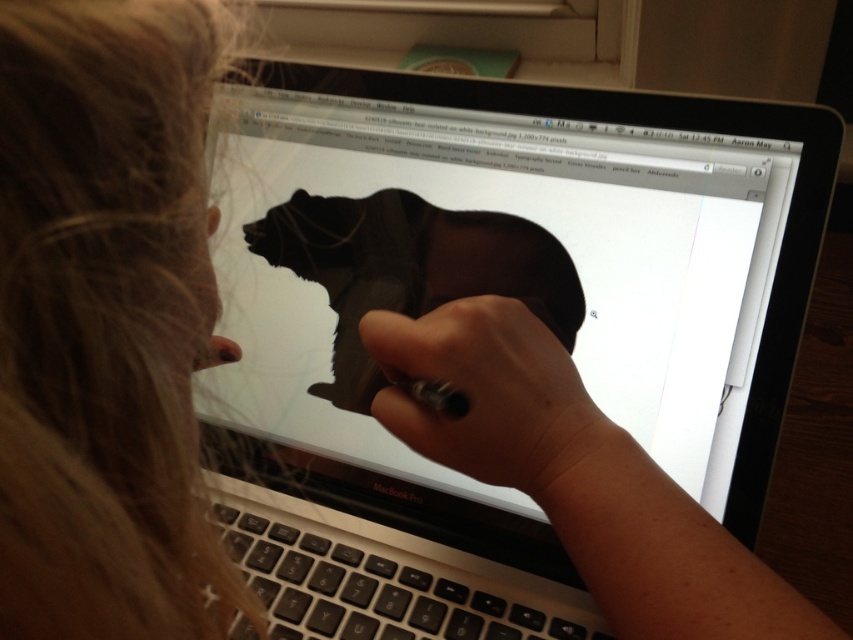
You are an artist trying to focus on drawing the black matte bear at center. However, you notice the blonde hair at upper left in your peripheral vision. Which object is closer to you, the artist, based on their positions in the scene?

The black matte bear at center is closer to you than the blonde hair at upper left, as the blonde hair is positioned behind the bear.

You are an art student trying to finish your bear drawing. You notice two bears on your screen, the black matte bear at center and the shiny black bear at center. Which one is positioned lower on the screen?

The black matte bear at center is located below the shiny black bear at center, so it is positioned lower on the screen.